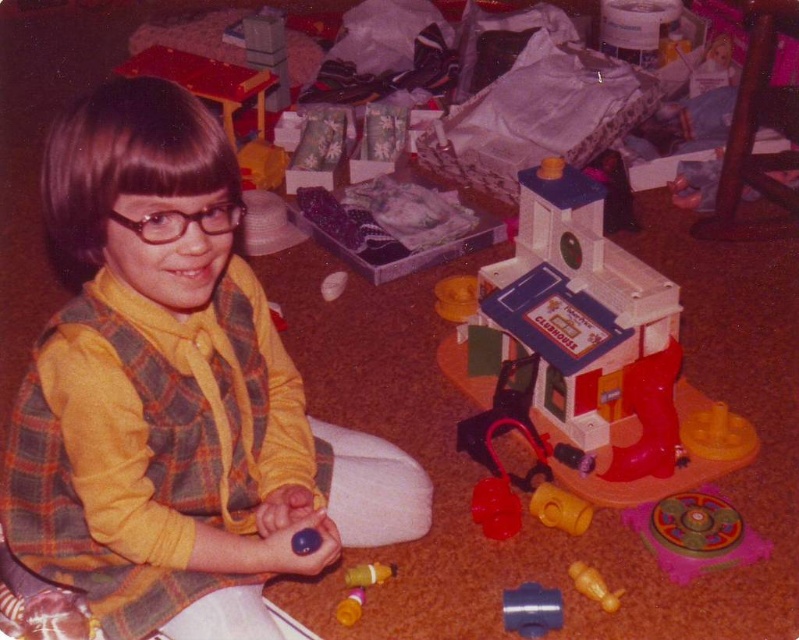
You are a child looking for your blue matte pipe at center and translucent yellow toy at center. You remember placing them both on the floor near the Clubhouse. Which object is closer to the ground?

The blue matte pipe at center is closer to the ground because it is located below the translucent yellow toy at center.

You are standing in the playroom and want to place a new toy on the floor. The toy requires a space that is at least 1.5 meters away from the camera to avoid being in the shot. Is the point at coordinates point (507,621) suitable for placing the toy?

The point point (507,621) is 1.45 meters from the camera, which is less than the required 1.5 meters. Therefore, placing the toy there would not be suitable as it would be too close to the camera.